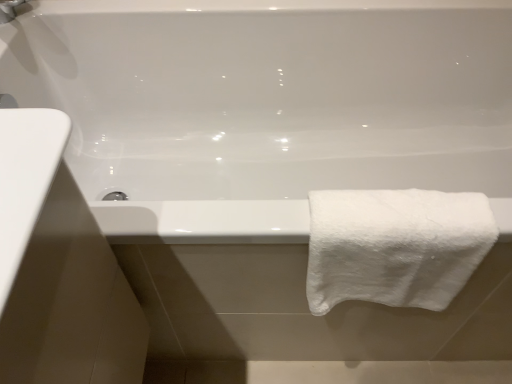
Describe the element at coordinates (9, 10) in the screenshot. I see `matte silver faucet at upper left` at that location.

You are a GUI agent. You are given a task and a screenshot of the screen. Output one action in this format:
    pyautogui.click(x=<x>, y=<y>)
    Task: Click on the matte silver faucet at upper left
    
    Given the screenshot: What is the action you would take?
    pyautogui.click(x=9, y=10)

Measure the distance between point (5, 13) and camera.

Point (5, 13) is 37.95 inches away from camera.

The width and height of the screenshot is (512, 384). Describe the element at coordinates (395, 246) in the screenshot. I see `white fluffy towel at right` at that location.

At what (x,y) coordinates should I click in order to perform the action: click on white fluffy towel at right. Please return your answer as a coordinate pair (x, y). Looking at the image, I should click on (395, 246).

Locate an element on the screen. matte silver faucet at upper left is located at coordinates (9, 10).

Is matte silver faucet at upper left to the left of white fluffy towel at right from the viewer's perspective?

Indeed, matte silver faucet at upper left is positioned on the left side of white fluffy towel at right.

Which object is further away from the camera, matte silver faucet at upper left or white fluffy towel at right?

matte silver faucet at upper left.

Is point (19, 0) closer to camera compared to point (353, 201)?

No.

From the image's perspective, would you say matte silver faucet at upper left is positioned over white fluffy towel at right?

Correct, matte silver faucet at upper left appears higher than white fluffy towel at right in the image.

From a real-world perspective, is matte silver faucet at upper left positioned under white fluffy towel at right based on gravity?

Result: Actually, matte silver faucet at upper left is physically above white fluffy towel at right in the real world.

Considering the sizes of objects matte silver faucet at upper left and white fluffy towel at right in the image provided, who is wider, matte silver faucet at upper left or white fluffy towel at right?

With larger width is white fluffy towel at right.

Which of these two, matte silver faucet at upper left or white fluffy towel at right, stands shorter?

Standing shorter between the two is matte silver faucet at upper left.

Between matte silver faucet at upper left and white fluffy towel at right, which one has larger size?

white fluffy towel at right.

Consider the image. Is matte silver faucet at upper left not within white fluffy towel at right?

matte silver faucet at upper left is positioned outside white fluffy towel at right.

Are matte silver faucet at upper left and white fluffy towel at right far apart?

No, there isn't a large distance between matte silver faucet at upper left and white fluffy towel at right.

Is matte silver faucet at upper left looking in the opposite direction of white fluffy towel at right?

No, white fluffy towel at right is not at the back of matte silver faucet at upper left.

How many degrees apart are the facing directions of matte silver faucet at upper left and white fluffy towel at right?

The angular difference between matte silver faucet at upper left and white fluffy towel at right is 53.6 degrees.

How far apart are matte silver faucet at upper left and white fluffy towel at right?

They are 37.79 inches apart.

Identify the location of towel below the matte silver faucet at upper left (from the image's perspective). This screenshot has width=512, height=384. (395, 246).

Is white fluffy towel at right at the right side of matte silver faucet at upper left?

Yes, white fluffy towel at right is to the right of matte silver faucet at upper left.

Considering the positions of objects white fluffy towel at right and matte silver faucet at upper left in the image provided, who is in front, white fluffy towel at right or matte silver faucet at upper left?

white fluffy towel at right.

Which is closer to the camera, (445, 203) or (25, 2)?

The point (445, 203) is closer to the camera.

From the image's perspective, is white fluffy towel at right above or below matte silver faucet at upper left?

white fluffy towel at right is situated lower than matte silver faucet at upper left in the image.

From a real-world perspective, is white fluffy towel at right beneath matte silver faucet at upper left?

Yes, from a real-world perspective, white fluffy towel at right is below matte silver faucet at upper left.

Does white fluffy towel at right have a greater width compared to matte silver faucet at upper left?

Yes, white fluffy towel at right is wider than matte silver faucet at upper left.

Does white fluffy towel at right have a lesser height compared to matte silver faucet at upper left?

No, white fluffy towel at right is not shorter than matte silver faucet at upper left.

Considering the sizes of white fluffy towel at right and matte silver faucet at upper left in the image, is white fluffy towel at right bigger or smaller than matte silver faucet at upper left?

Clearly, white fluffy towel at right is larger in size than matte silver faucet at upper left.

Is white fluffy towel at right not inside matte silver faucet at upper left?

Yes.

Can you see white fluffy towel at right touching matte silver faucet at upper left?

Result: There is a gap between white fluffy towel at right and matte silver faucet at upper left.

Is matte silver faucet at upper left at the back of white fluffy towel at right?

white fluffy towel at right does not have its back to matte silver faucet at upper left.

How many degrees apart are the facing directions of white fluffy towel at right and matte silver faucet at upper left?

The angle between the facing direction of white fluffy towel at right and the facing direction of matte silver faucet at upper left is 53.6 degrees.

At what (x,y) coordinates should I click in order to perform the action: click on faucet on the left side of white fluffy towel at right. Please return your answer as a coordinate pair (x, y). The height and width of the screenshot is (384, 512). Looking at the image, I should click on (9, 10).

Find the location of a particular element. This screenshot has width=512, height=384. towel below the matte silver faucet at upper left (from a real-world perspective) is located at coordinates (395, 246).

Locate an element on the screen. Image resolution: width=512 pixels, height=384 pixels. towel on the right of the matte silver faucet at upper left is located at coordinates click(x=395, y=246).